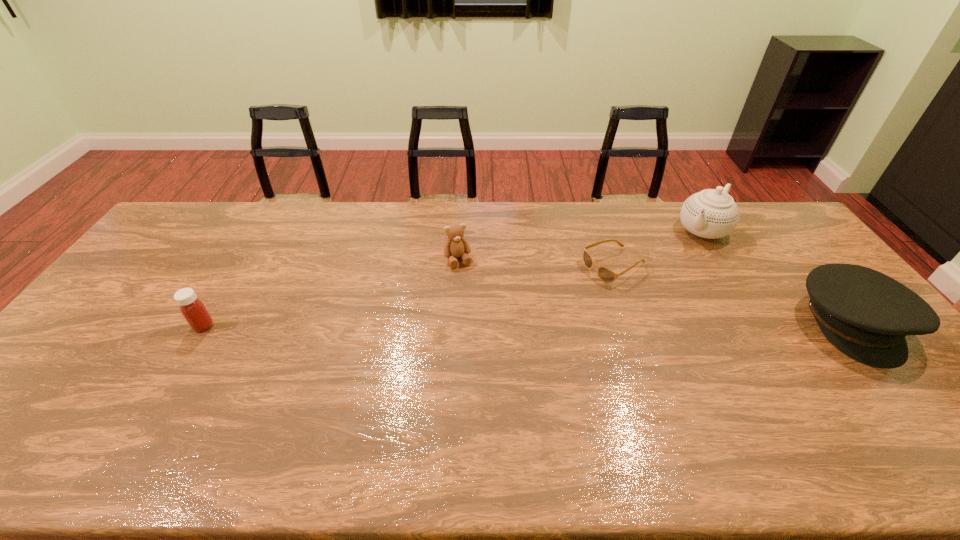
Locate an element on the screen. This screenshot has height=540, width=960. free space located on the front-facing side of the third object from left to right is located at coordinates (550, 296).

The image size is (960, 540). Find the location of `vacant space located 0.330m on the front-facing side of the third object from left to right`. vacant space located 0.330m on the front-facing side of the third object from left to right is located at coordinates (503, 319).

In order to click on free space located 0.050m on the front-facing side of the second object from left to right in this screenshot , I will do `click(466, 280)`.

Where is `free spot located 0.060m on the front-facing side of the second object from left to right`? Image resolution: width=960 pixels, height=540 pixels. free spot located 0.060m on the front-facing side of the second object from left to right is located at coordinates (467, 282).

You are a GUI agent. You are given a task and a screenshot of the screen. Output one action in this format:
    pyautogui.click(x=<x>, y=<y>)
    Task: Click on the free spot located 0.060m on the front-facing side of the second object from left to right
    The height and width of the screenshot is (540, 960).
    Given the screenshot: What is the action you would take?
    pyautogui.click(x=467, y=282)

Identify the location of vacant space located 0.270m on the spout of the tallest object. (655, 283).

Locate an element on the screen. The height and width of the screenshot is (540, 960). free space located on the spout of the tallest object is located at coordinates (684, 251).

The height and width of the screenshot is (540, 960). Find the location of `vacant region located on the spout of the tallest object`. vacant region located on the spout of the tallest object is located at coordinates (636, 303).

Identify the location of object that is at the far edge. (712, 213).

Where is `object situated at the right edge`? The height and width of the screenshot is (540, 960). object situated at the right edge is located at coordinates (867, 315).